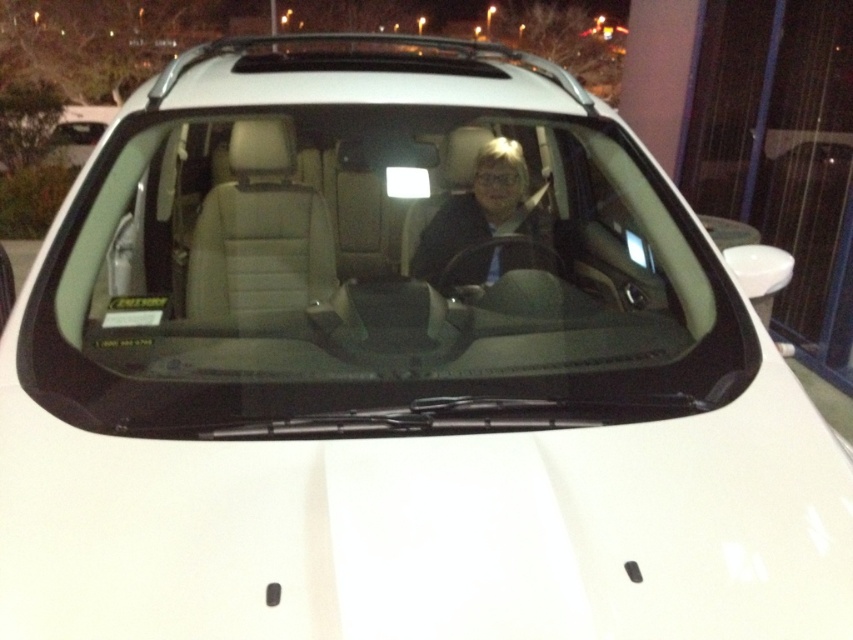
In the scene shown: Can you confirm if transparent glass windshield at center is positioned above matte black jacket at center?

No, transparent glass windshield at center is not above matte black jacket at center.

Is transparent glass windshield at center wider than matte black jacket at center?

Correct, the width of transparent glass windshield at center exceeds that of matte black jacket at center.

Image resolution: width=853 pixels, height=640 pixels. Describe the element at coordinates (378, 250) in the screenshot. I see `transparent glass windshield at center` at that location.

At what (x,y) coordinates should I click in order to perform the action: click on transparent glass windshield at center. Please return your answer as a coordinate pair (x, y). Looking at the image, I should click on (378, 250).